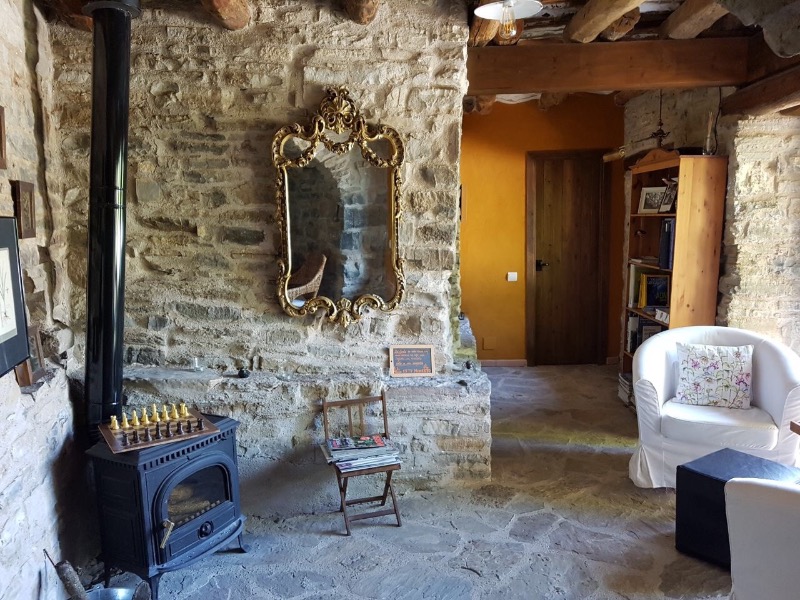
Locate an element on the screen. white upholstered chair is located at coordinates (770, 562), (770, 411).